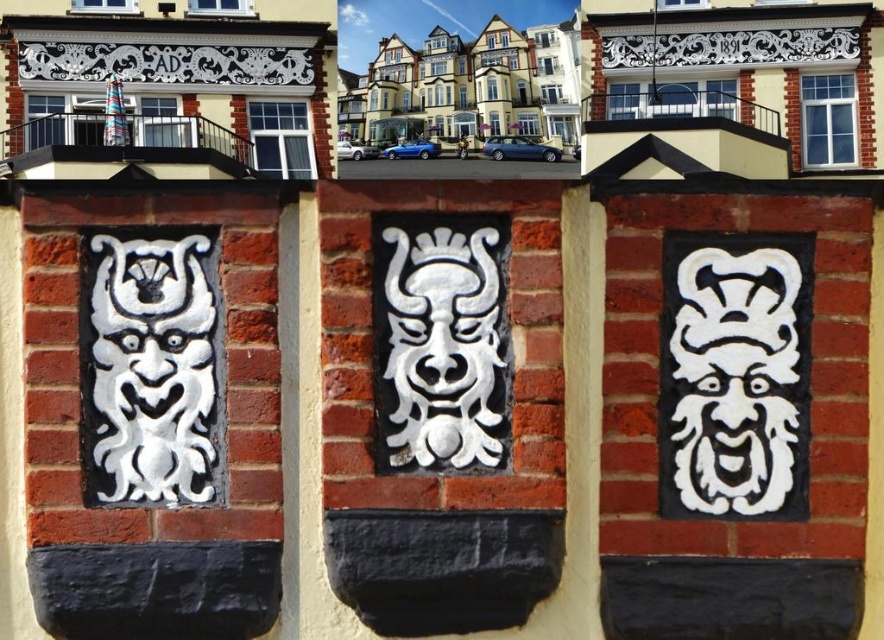
Question: In this image, where is white matte mask at center left located relative to white painted stone mask at center?

Choices:
 (A) left
 (B) right

Answer: (A)

Question: Is white matte mask at center left below white matte stone mask at center?

Choices:
 (A) yes
 (B) no

Answer: (B)

Question: Estimate the real-world distances between objects in this image. Which object is farther from the white matte mask at center left?

Choices:
 (A) white matte stone mask at center
 (B) white painted stone mask at center

Answer: (A)

Question: Which of the following is the farthest from the observer?

Choices:
 (A) (705, 467)
 (B) (142, 346)

Answer: (A)

Question: Is white matte mask at center left thinner than white matte stone mask at center?

Choices:
 (A) yes
 (B) no

Answer: (A)

Question: Which object is positioned farthest from the white painted stone mask at center?

Choices:
 (A) white matte mask at center left
 (B) white matte stone mask at center

Answer: (B)